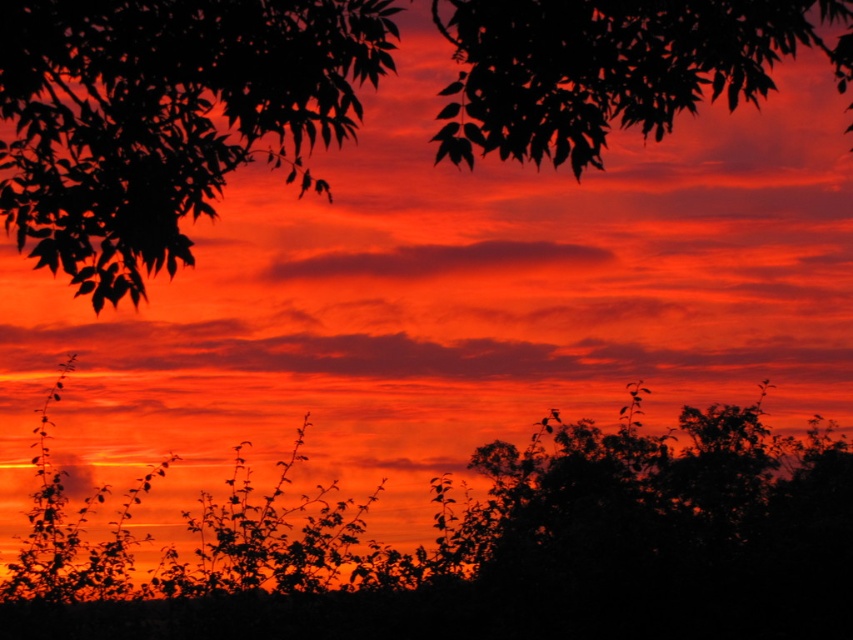
You are an artist trying to paint this sunset scene. You want to ensure that the silky leaves at upper left and the matte orange cloud at center are positioned correctly. Based on the scene, which object should appear closer to the viewer?

The silky leaves at upper left should appear closer to the viewer because they are positioned in front of the matte orange cloud at center.

You are an astronomer analyzing the sunset image. You need to locate the silky leaves at upper left. What are their coordinates?

The silky leaves at upper left are located at coordinates point (165, 116).